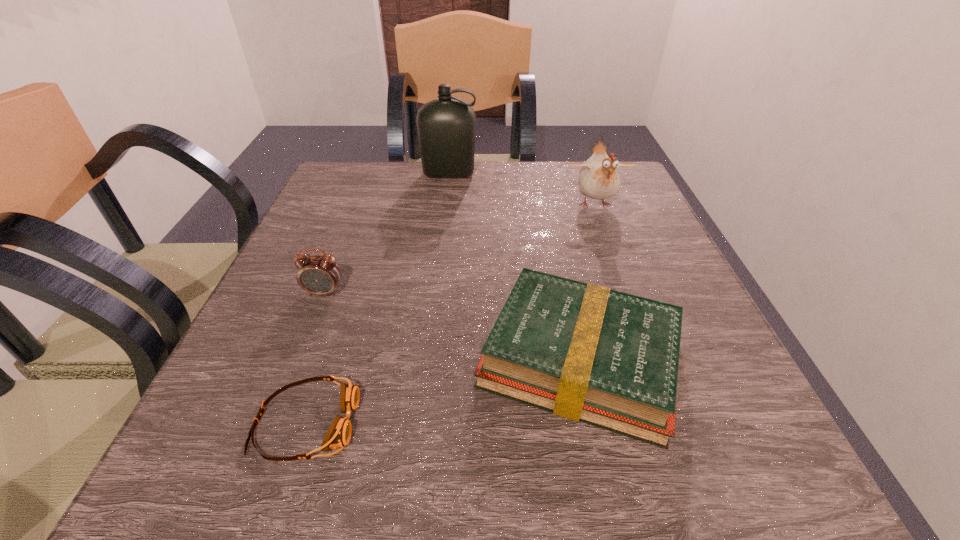
Where is `vacant area that lies between the second shortest object and the farthest object`? vacant area that lies between the second shortest object and the farthest object is located at coordinates (515, 267).

Locate an element on the screen. This screenshot has width=960, height=540. empty space that is in between the hardback book and the bottle is located at coordinates (515, 267).

Identify the location of vacant area that lies between the hardback book and the third shortest object. Image resolution: width=960 pixels, height=540 pixels. pos(452,326).

The image size is (960, 540). Find the location of `empty location between the shortest object and the farthest object`. empty location between the shortest object and the farthest object is located at coordinates (377, 299).

Where is `free space between the third tallest object and the goggles`? The width and height of the screenshot is (960, 540). free space between the third tallest object and the goggles is located at coordinates (315, 357).

Identify the location of vacant space that is in between the alarm clock and the fourth tallest object. (452, 326).

This screenshot has height=540, width=960. Identify the location of free spot between the alarm clock and the bottle. (387, 233).

Identify the location of free space between the bird and the alarm clock. The height and width of the screenshot is (540, 960). (460, 249).

Image resolution: width=960 pixels, height=540 pixels. I want to click on blank region between the second tallest object and the alarm clock, so click(460, 249).

Locate which object ranks third in proximity to the bottle. Please provide its 2D coordinates. Your answer should be formatted as a tuple, i.e. [(x, y)], where the tuple contains the x and y coordinates of a point satisfying the conditions above.

[(585, 352)]